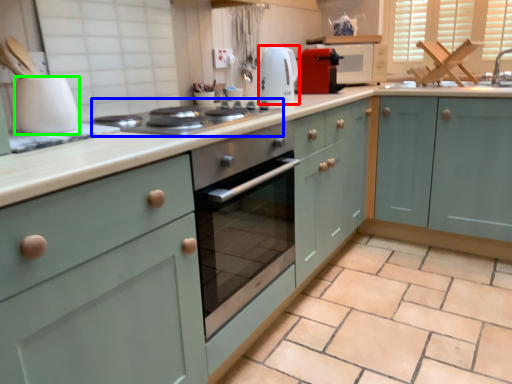
Question: Considering the real-world distances, which object is closest to kitchen appliance (highlighted by a red box)? home appliance (highlighted by a blue box) or kitchen appliance (highlighted by a green box).

Choices:
 (A) home appliance
 (B) kitchen appliance

Answer: (A)